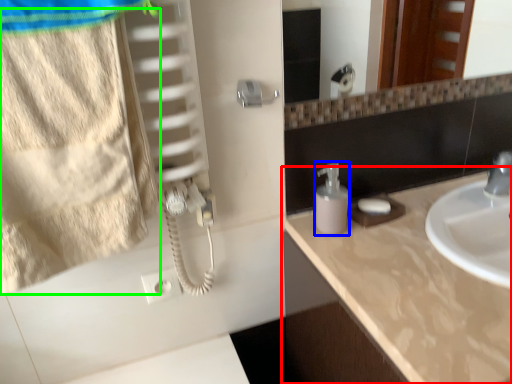
Question: Which object is positioned closest to countertop (highlighted by a red box)? Select from soap dispenser (highlighted by a blue box) and beach towel (highlighted by a green box).

Choices:
 (A) soap dispenser
 (B) beach towel

Answer: (A)